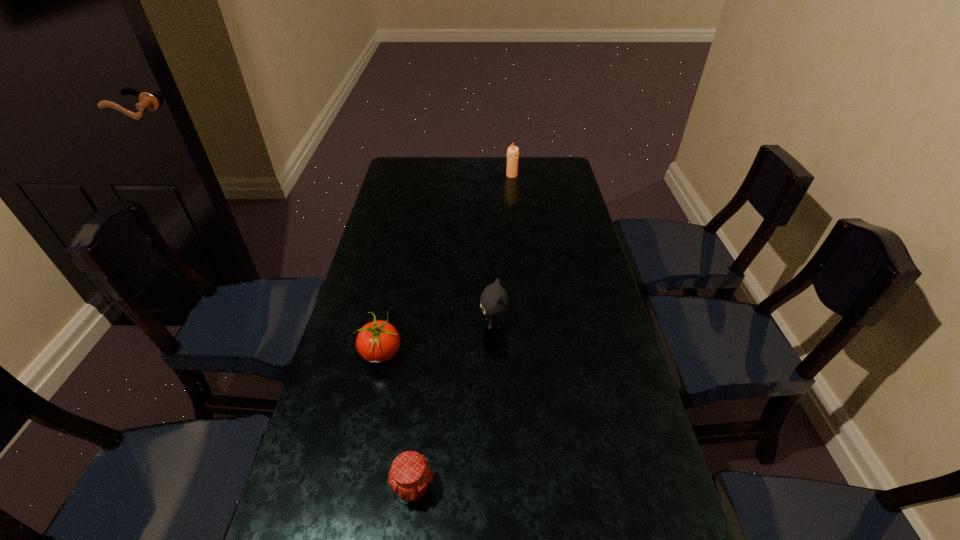
Locate an element on the screen. Image resolution: width=960 pixels, height=540 pixels. vacant area situated 0.300m on the back of the tomato is located at coordinates (399, 264).

I want to click on vacant area situated on the left of the jam, so click(341, 488).

You are a GUI agent. You are given a task and a screenshot of the screen. Output one action in this format:
    pyautogui.click(x=<x>, y=<y>)
    Task: Click on the object present at the far edge
    This screenshot has width=960, height=540.
    Given the screenshot: What is the action you would take?
    pyautogui.click(x=513, y=151)

Where is `object positioned at the left edge`? This screenshot has height=540, width=960. object positioned at the left edge is located at coordinates (378, 341).

Image resolution: width=960 pixels, height=540 pixels. I want to click on vacant space at the far edge of the desktop, so click(x=502, y=179).

In the image, there is a desktop. At what (x,y) coordinates should I click in order to perform the action: click on vacant space at the left edge. Please return your answer as a coordinate pair (x, y). Looking at the image, I should click on (363, 258).

In the image, there is a desktop. Find the location of `free space at the right edge`. free space at the right edge is located at coordinates (580, 363).

Locate an element on the screen. This screenshot has width=960, height=540. vacant position at the far left corner of the desktop is located at coordinates (430, 157).

This screenshot has height=540, width=960. I want to click on vacant space at the far right corner of the desktop, so click(x=536, y=173).

Find the location of a particular element. This screenshot has height=540, width=960. vacant area that lies between the kitten and the leftmost object is located at coordinates (438, 339).